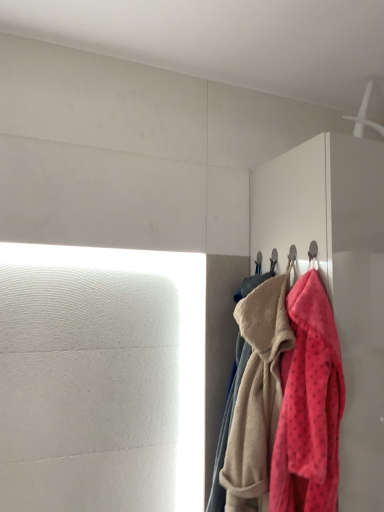
Question: Is fluffy pink towel at right, acting as the 1th towel starting from the front, oriented away from matte white dresser at right?

Choices:
 (A) yes
 (B) no

Answer: (A)

Question: Considering the relative positions of fluffy pink towel at right, acting as the 1th towel starting from the front, and matte white dresser at right in the image provided, is fluffy pink towel at right, acting as the 1th towel starting from the front, behind matte white dresser at right?

Choices:
 (A) no
 (B) yes

Answer: (A)

Question: Is fluffy pink towel at right, placed as the 2th towel when sorted from back to front, to the right of matte white dresser at right from the viewer's perspective?

Choices:
 (A) no
 (B) yes

Answer: (A)

Question: Is fluffy pink towel at right, acting as the 1th towel starting from the front, closer to camera compared to matte white dresser at right?

Choices:
 (A) no
 (B) yes

Answer: (B)

Question: Is matte white dresser at right a part of fluffy pink towel at right, acting as the 1th towel starting from the front?

Choices:
 (A) no
 (B) yes

Answer: (A)

Question: From the image's perspective, is fluffy pink towel at right, placed as the second towel when sorted from front to back, located above or below fluffy pink towel at right, acting as the 1th towel starting from the front?

Choices:
 (A) above
 (B) below

Answer: (B)

Question: Is point (248, 300) positioned closer to the camera than point (278, 472)?

Choices:
 (A) farther
 (B) closer

Answer: (A)

Question: Is fluffy pink towel at right, placed as the second towel when sorted from front to back, situated inside fluffy pink towel at right, acting as the 1th towel starting from the front, or outside?

Choices:
 (A) inside
 (B) outside

Answer: (B)

Question: Considering their positions, is fluffy pink towel at right, placed as the second towel when sorted from front to back, located in front of or behind fluffy pink towel at right, acting as the 1th towel starting from the front?

Choices:
 (A) front
 (B) behind

Answer: (B)

Question: Is point (238, 457) positioned closer to the camera than point (334, 175)?

Choices:
 (A) closer
 (B) farther

Answer: (A)

Question: Is fluffy pink towel at right, marked as the first towel in a back-to-front arrangement, spatially inside matte white dresser at right, or outside of it?

Choices:
 (A) outside
 (B) inside

Answer: (A)

Question: In the image, is fluffy pink towel at right, marked as the first towel in a back-to-front arrangement, positioned in front of or behind matte white dresser at right?

Choices:
 (A) behind
 (B) front

Answer: (A)

Question: Is fluffy pink towel at right, marked as the first towel in a back-to-front arrangement, taller or shorter than matte white dresser at right?

Choices:
 (A) short
 (B) tall

Answer: (A)

Question: In terms of height, does fluffy pink towel at right, acting as the 1th towel starting from the front, look taller or shorter compared to fluffy pink towel at right, marked as the first towel in a back-to-front arrangement?

Choices:
 (A) short
 (B) tall

Answer: (A)

Question: Considering their positions, is fluffy pink towel at right, acting as the 1th towel starting from the front, located in front of or behind fluffy pink towel at right, marked as the first towel in a back-to-front arrangement?

Choices:
 (A) behind
 (B) front

Answer: (B)